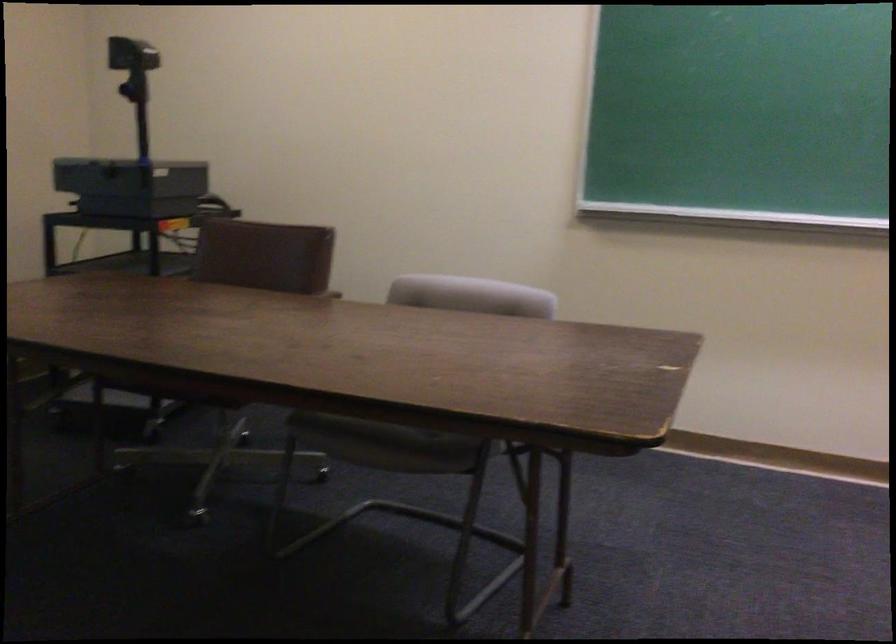
At what (x,y) coordinates should I click in order to perform the action: click on projector head. Please return your answer as a coordinate pair (x, y). Looking at the image, I should click on (131, 53).